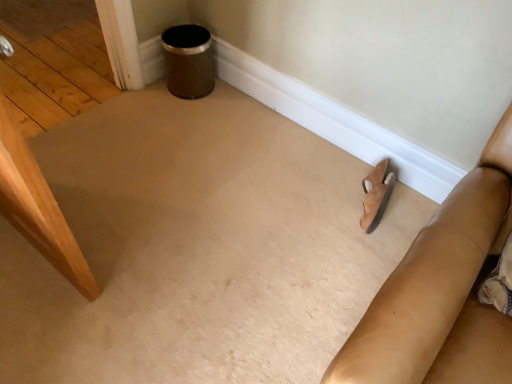
Question: In the image, is suede-like tan couch at lower right positioned in front of or behind suede sandal at lower right?

Choices:
 (A) front
 (B) behind

Answer: (A)

Question: In terms of height, does suede-like tan couch at lower right look taller or shorter compared to suede sandal at lower right?

Choices:
 (A) tall
 (B) short

Answer: (A)

Question: Is suede-like tan couch at lower right to the left or to the right of suede sandal at lower right in the image?

Choices:
 (A) left
 (B) right

Answer: (B)

Question: Considering the positions of suede sandal at lower right and suede-like tan couch at lower right in the image, is suede sandal at lower right wider or thinner than suede-like tan couch at lower right?

Choices:
 (A) wide
 (B) thin

Answer: (B)

Question: In the image, is suede sandal at lower right on the left side or the right side of suede-like tan couch at lower right?

Choices:
 (A) left
 (B) right

Answer: (A)

Question: From a real-world perspective, is suede sandal at lower right positioned above or below suede-like tan couch at lower right?

Choices:
 (A) above
 (B) below

Answer: (B)

Question: From the image's perspective, is suede sandal at lower right above or below suede-like tan couch at lower right?

Choices:
 (A) below
 (B) above

Answer: (B)